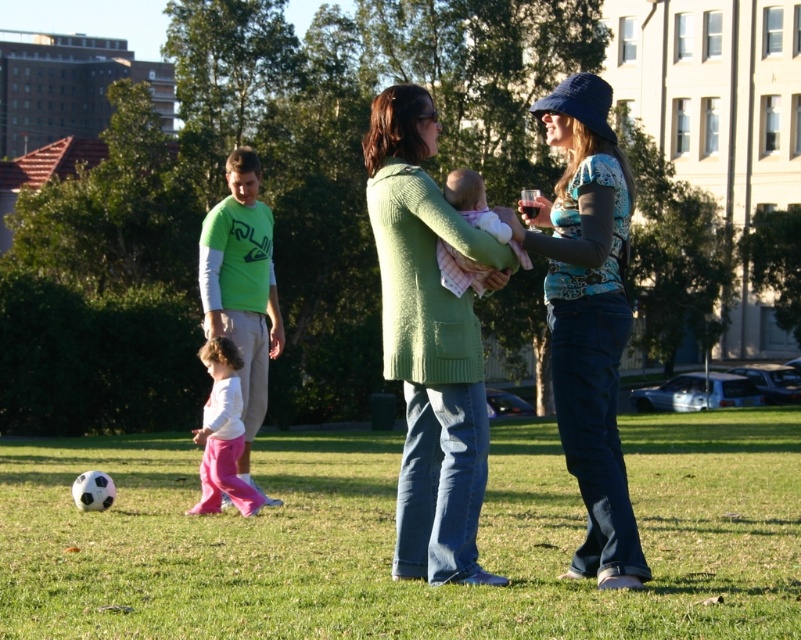
Between white soccer ball at lower left and green knitted sweater at center, which one has less height?

With less height is white soccer ball at lower left.

Can you confirm if white soccer ball at lower left is smaller than green knitted sweater at center?

Incorrect, white soccer ball at lower left is not smaller in size than green knitted sweater at center.

Is point (329, 516) closer to viewer compared to point (417, 563)?

No, it is not.

Where is `white soccer ball at lower left`? Image resolution: width=801 pixels, height=640 pixels. white soccer ball at lower left is located at coordinates (393, 538).

Is point (461, 248) farther from viewer compared to point (252, 230)?

No, (461, 248) is in front of (252, 230).

Identify the location of green knitted sweater at center. The image size is (801, 640). (429, 342).

This screenshot has height=640, width=801. What do you see at coordinates (429, 342) in the screenshot? I see `green knitted sweater at center` at bounding box center [429, 342].

You are a GUI agent. You are given a task and a screenshot of the screen. Output one action in this format:
    pyautogui.click(x=<x>, y=<y>)
    Task: Click on the green knitted sweater at center
    The image size is (801, 640).
    Given the screenshot: What is the action you would take?
    pyautogui.click(x=429, y=342)

This screenshot has width=801, height=640. What do you see at coordinates (425, 323) in the screenshot?
I see `matte green sweater at center` at bounding box center [425, 323].

Is point (467, 509) positioned after point (266, 288)?

No, it is in front of (266, 288).

Find the location of a particular element. matte green sweater at center is located at coordinates (425, 323).